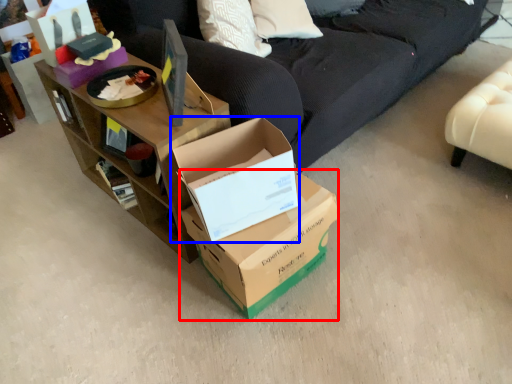
Question: Which of the following is the closest to the observer, box (highlighted by a red box) or box (highlighted by a blue box)?

Choices:
 (A) box
 (B) box

Answer: (B)